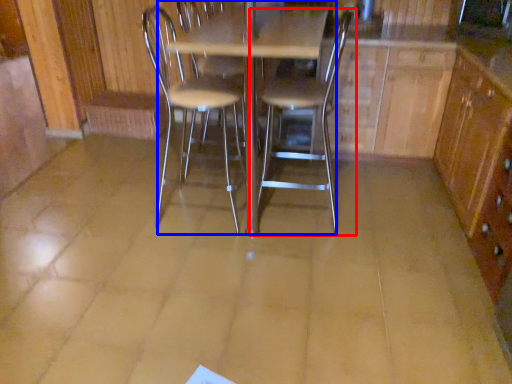
Question: Among these objects, which one is nearest to the camera, chair (highlighted by a red box) or table (highlighted by a blue box)?

Choices:
 (A) chair
 (B) table

Answer: (B)